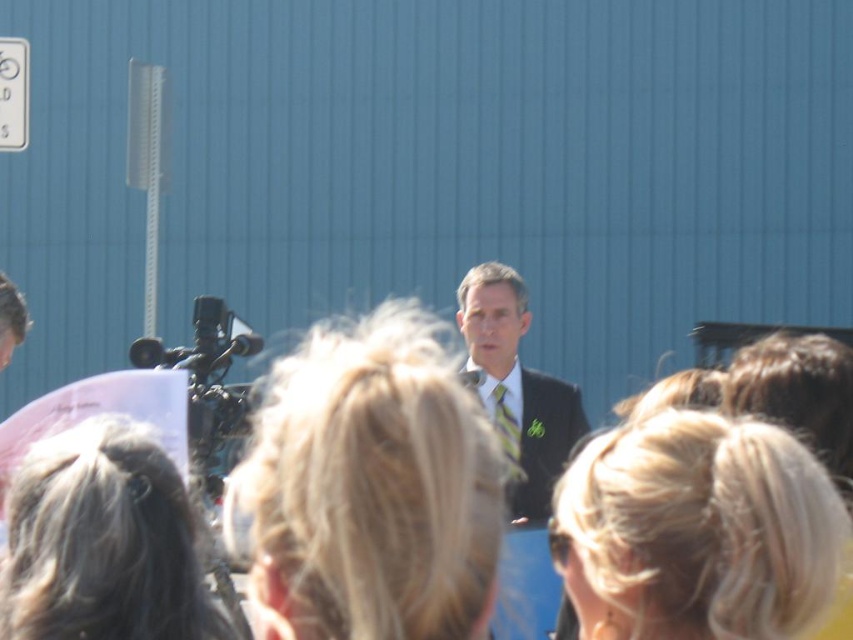
You are a photographer at the event and need to ensure that both the dark suit at center and the metallic rectangular at upper left are visible in your photo. Given that the camera has a fixed focal length, which object should you prioritize framing closer to the edge of the frame to avoid cropping the other?

The metallic rectangular at upper left should be framed closer to the edge of the frame because the dark suit at center is larger in size and requires more space in the composition to avoid cropping.

You are a photographer positioned at the back of the audience. You want to capture a clear photo of the green striped tie at center without the metallic rectangular at upper left blocking the view. What should you do?

The metallic rectangular at upper left is above the green striped tie at center, so you should lower your camera angle to avoid the metallic rectangular at upper left blocking the view.